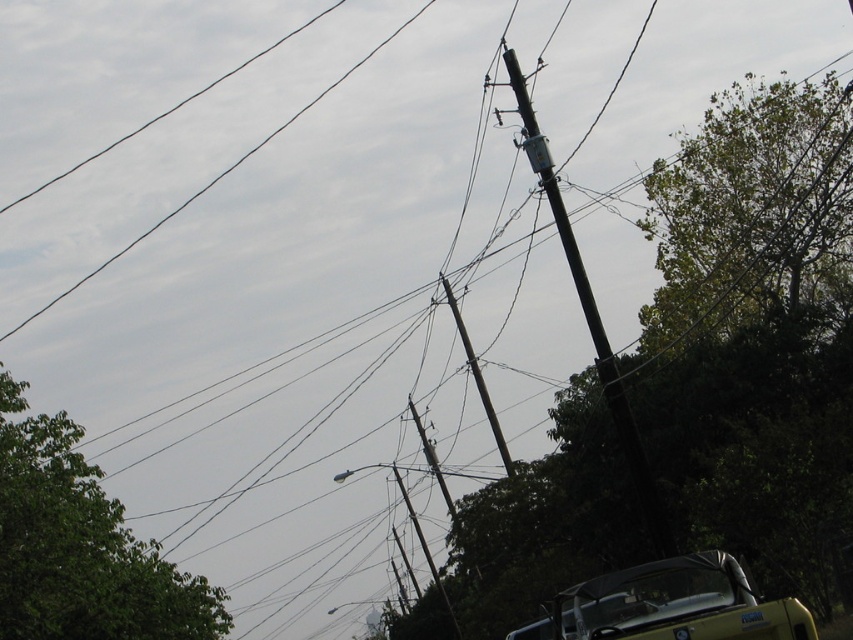
You are a delivery driver who needs to pass through the area shown in the image. You see the yellow matte convertible at lower right and the black metallic pole at upper center. Which object has a smaller width when viewed from your perspective?

The yellow matte convertible at lower right has a smaller width than the black metallic pole at upper center, so the convertible is thinner.

You are standing at the camera position and want to reach the point at coordinates (808, 468). Given that your maximum walking distance is 60 feet, can you reach it without exceeding your limit?

The point at coordinates (808, 468) is 58.85 feet away from the camera, so yes, you can reach it without exceeding your 60 feet limit.

Based on the coordinates given, where is the green leafy tree at upper right located in the image?

Result: The green leafy tree at upper right is located at the 2D coordinates point (753,333) in the image.